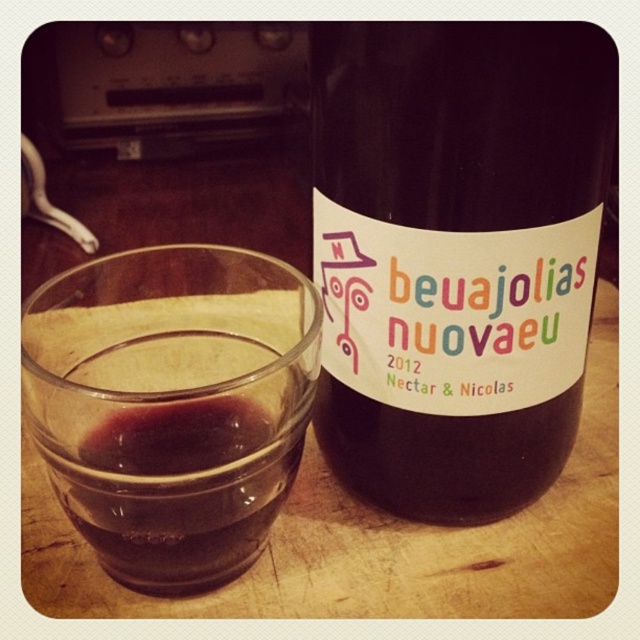
Measure the distance between dark glass bottle at center and dark red glass at center.

dark glass bottle at center is 2.43 inches from dark red glass at center.

Does dark glass bottle at center appear on the right side of dark red glass at center?

Indeed, dark glass bottle at center is positioned on the right side of dark red glass at center.

Between point (516, 396) and point (140, 451), which one is positioned behind?

Point (516, 396)

I want to click on dark glass bottle at center, so click(456, 253).